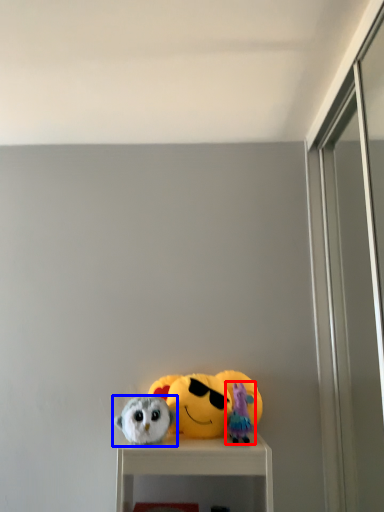
Question: Which object is closer to the camera taking this photo, toy (highlighted by a red box) or toy (highlighted by a blue box)?

Choices:
 (A) toy
 (B) toy

Answer: (B)